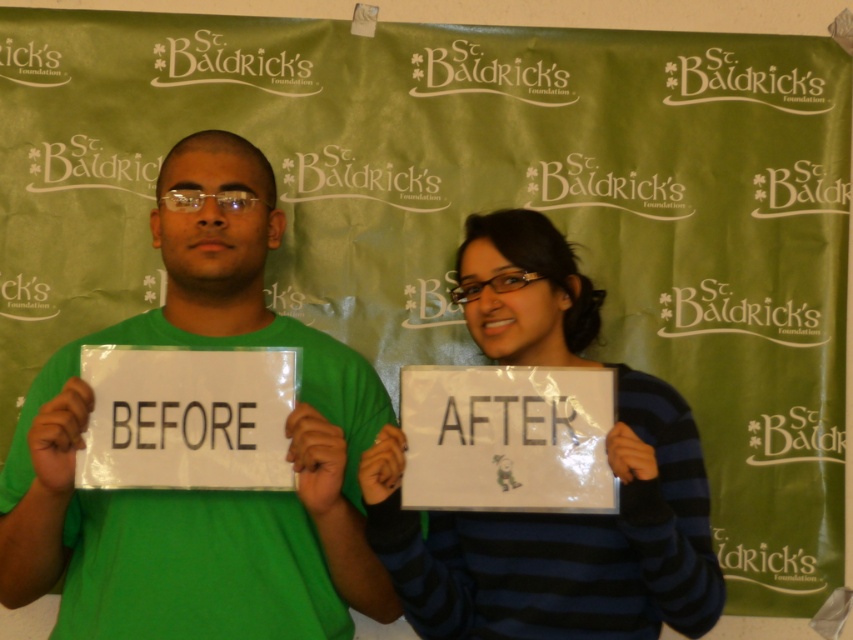
Question: Is green matte shirt at center smaller than striped sweater at center?

Choices:
 (A) no
 (B) yes

Answer: (A)

Question: Is the position of green matte shirt at center less distant than that of striped sweater at center?

Choices:
 (A) no
 (B) yes

Answer: (A)

Question: Which point is closer to the camera?

Choices:
 (A) green matte shirt at center
 (B) striped sweater at center

Answer: (B)

Question: Among these objects, which one is farthest from the camera?

Choices:
 (A) green matte shirt at center
 (B) striped sweater at center

Answer: (A)

Question: Observing the image, what is the correct spatial positioning of green matte shirt at center in reference to striped sweater at center?

Choices:
 (A) above
 (B) below

Answer: (A)